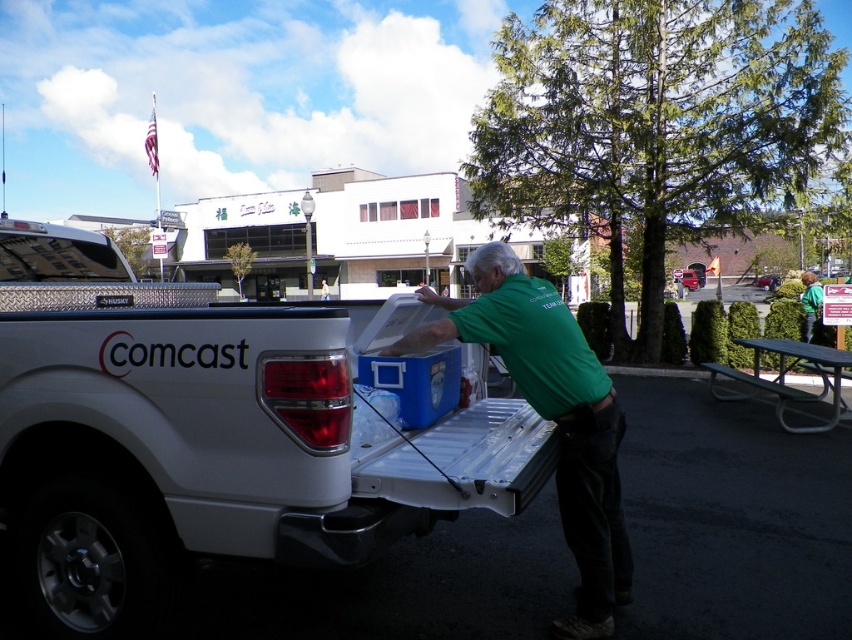
The image size is (852, 640). I want to click on blue plastic cooler at center, so click(204, 436).

Does blue plastic cooler at center have a greater width compared to green fabric shirt at center?

Incorrect, blue plastic cooler at center's width does not surpass green fabric shirt at center's.

Image resolution: width=852 pixels, height=640 pixels. What do you see at coordinates (204, 436) in the screenshot? I see `blue plastic cooler at center` at bounding box center [204, 436].

Locate an element on the screen. blue plastic cooler at center is located at coordinates (204, 436).

Is point (537, 285) positioned after point (820, 376)?

No, it is not.

Who is shorter, green fabric shirt at center or metallic gray picnic table at right?

metallic gray picnic table at right is shorter.

Describe the element at coordinates (551, 416) in the screenshot. I see `green fabric shirt at center` at that location.

Find the location of `green fabric shirt at center`. green fabric shirt at center is located at coordinates (551, 416).

Is blue plastic cooler at center thinner than metallic gray picnic table at right?

Yes, blue plastic cooler at center is thinner than metallic gray picnic table at right.

At what (x,y) coordinates should I click in order to perform the action: click on blue plastic cooler at center. Please return your answer as a coordinate pair (x, y). This screenshot has width=852, height=640. Looking at the image, I should click on (204, 436).